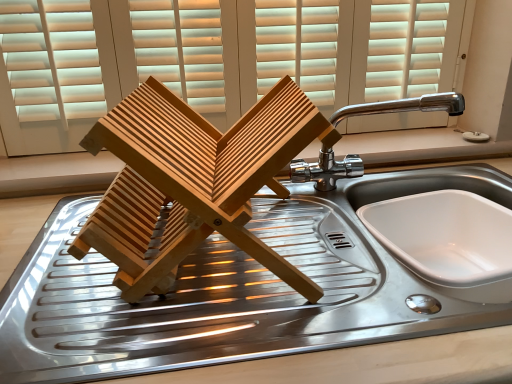
What is the approximate width of wooden blinds at upper center?

3.32 inches.

This screenshot has height=384, width=512. What do you see at coordinates (405, 106) in the screenshot? I see `chrome metallic faucet at upper right` at bounding box center [405, 106].

Find the location of `white glossy sink at lower right`. white glossy sink at lower right is located at coordinates (448, 237).

Is wooden blinds at upper center taller than chrome metallic faucet at upper right?

Indeed, wooden blinds at upper center has a greater height compared to chrome metallic faucet at upper right.

Does wooden blinds at upper center have a smaller size compared to chrome metallic faucet at upper right?

Incorrect, wooden blinds at upper center is not smaller in size than chrome metallic faucet at upper right.

From a real-world perspective, is wooden blinds at upper center on chrome metallic faucet at upper right?

Indeed, from a real-world perspective, wooden blinds at upper center stands above chrome metallic faucet at upper right.

The width and height of the screenshot is (512, 384). Identify the location of window above the chrome metallic faucet at upper right (from the image's perspective). (215, 57).

Between chrome metallic faucet at upper right and white glossy sink at lower right, which one has more height?

chrome metallic faucet at upper right.

Which is nearer, [317,184] or [453,287]?

Clearly, point [317,184] is more distant from the camera than point [453,287].

Is chrome metallic faucet at upper right facing away from white glossy sink at lower right?

No, chrome metallic faucet at upper right is not facing the opposite direction of white glossy sink at lower right.

Considering the positions of objects chrome metallic faucet at upper right and wooden blinds at upper center in the image provided, who is more to the right, chrome metallic faucet at upper right or wooden blinds at upper center?

Positioned to the right is chrome metallic faucet at upper right.

From the image's perspective, is chrome metallic faucet at upper right located above or below wooden blinds at upper center?

chrome metallic faucet at upper right is below wooden blinds at upper center.

Can you confirm if chrome metallic faucet at upper right is wider than wooden blinds at upper center?

Yes, chrome metallic faucet at upper right is wider than wooden blinds at upper center.

Can you tell me how much wooden blinds at upper center and white glossy sink at lower right differ in facing direction?

The facing directions of wooden blinds at upper center and white glossy sink at lower right are 8.76 degrees apart.

From a real-world perspective, is wooden blinds at upper center under white glossy sink at lower right?

No, from a real-world perspective, wooden blinds at upper center is not beneath white glossy sink at lower right.

Image resolution: width=512 pixels, height=384 pixels. In the image, there is a wooden blinds at upper center. What are the coordinates of `sink below it (from a real-world perspective)` in the screenshot? It's located at (448, 237).

Can you confirm if wooden blinds at upper center is shorter than white glossy sink at lower right?

In fact, wooden blinds at upper center may be taller than white glossy sink at lower right.

Considering the positions of points (480, 208) and (297, 166), is point (480, 208) farther from camera compared to point (297, 166)?

No.

Looking at this image, considering the sizes of white glossy sink at lower right and chrome metallic faucet at upper right in the image, is white glossy sink at lower right wider or thinner than chrome metallic faucet at upper right?

Clearly, white glossy sink at lower right has more width compared to chrome metallic faucet at upper right.

Does white glossy sink at lower right lie behind chrome metallic faucet at upper right?

No, it is in front of chrome metallic faucet at upper right.

Is white glossy sink at lower right shorter than chrome metallic faucet at upper right?

Correct, white glossy sink at lower right is not as tall as chrome metallic faucet at upper right.

Is point (464, 211) farther from viewer compared to point (63, 56)?

No, (464, 211) is in front of (63, 56).

Based on the photo, is white glossy sink at lower right closer to the viewer compared to wooden blinds at upper center?

That is True.

Is white glossy sink at lower right looking in the opposite direction of wooden blinds at upper center?

white glossy sink at lower right is not turned away from wooden blinds at upper center.

Is wooden blinds at upper center a part of white glossy sink at lower right?

That's incorrect, wooden blinds at upper center is not inside white glossy sink at lower right.

Locate an element on the screen. window above the chrome metallic faucet at upper right (from the image's perspective) is located at coordinates (215, 57).

Locate an element on the screen. The width and height of the screenshot is (512, 384). tap behind the white glossy sink at lower right is located at coordinates (405, 106).

Considering their positions, is chrome metallic faucet at upper right positioned closer to white glossy sink at lower right than wooden blinds at upper center?

chrome metallic faucet at upper right lies closer to white glossy sink at lower right than the other object.

From the image, which object appears to be nearer to chrome metallic faucet at upper right, white glossy sink at lower right or wooden blinds at upper center?

Among the two, white glossy sink at lower right is located nearer to chrome metallic faucet at upper right.

Looking at the image, which one is located further to wooden blinds at upper center, chrome metallic faucet at upper right or white glossy sink at lower right?

white glossy sink at lower right.

When comparing their distances from white glossy sink at lower right, does wooden blinds at upper center or chrome metallic faucet at upper right seem further?

wooden blinds at upper center.

Based on their spatial positions, is wooden blinds at upper center or white glossy sink at lower right closer to chrome metallic faucet at upper right?

white glossy sink at lower right lies closer to chrome metallic faucet at upper right than the other object.

Considering their positions, is white glossy sink at lower right positioned further to wooden blinds at upper center than chrome metallic faucet at upper right?

Based on the image, white glossy sink at lower right appears to be further to wooden blinds at upper center.

Locate an element on the screen. The width and height of the screenshot is (512, 384). tap between wooden blinds at upper center and white glossy sink at lower right in the horizontal direction is located at coordinates point(405,106).